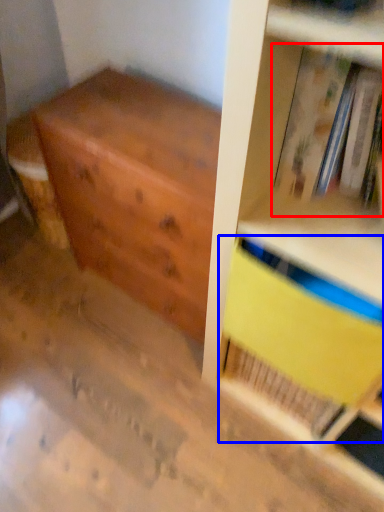
Question: Which object is further to the camera taking this photo, book (highlighted by a red box) or paperback book (highlighted by a blue box)?

Choices:
 (A) book
 (B) paperback book

Answer: (B)